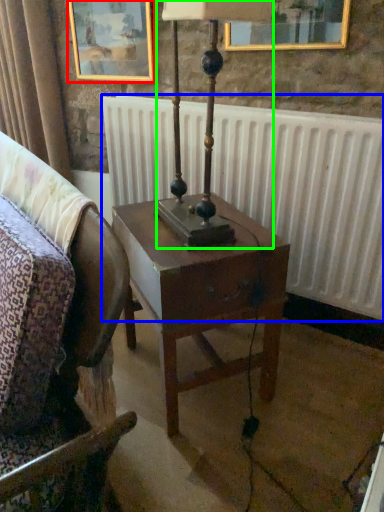
Question: Which is farther away from picture frame (highlighted by a red box)? radiator (highlighted by a blue box) or bedside lamp (highlighted by a green box)?

Choices:
 (A) radiator
 (B) bedside lamp

Answer: (B)